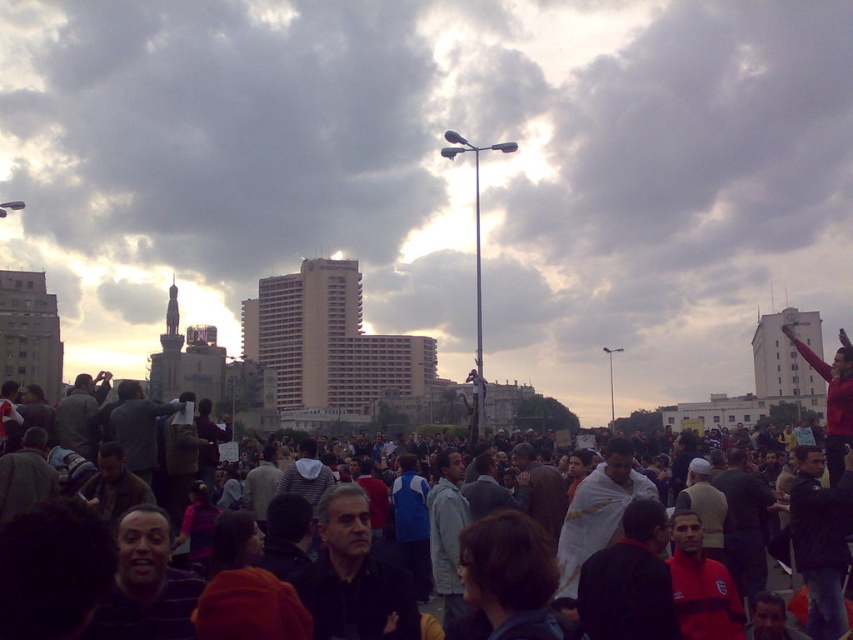
You are a photographer standing in the crowd and want to take a photo of the cloudy sky at upper center without the dark clothing crowd at center blocking the view. Is this possible?

The cloudy sky at upper center is further to the viewer than the dark clothing crowd at center, so the crowd is between the photographer and the sky. Therefore, the dark clothing crowd at center would block the view of the cloudy sky at upper center, making it impossible to take a clear photo without obstruction.

Consider the image. You are standing at the point closest to the center of the image. Which of the two points, point (801, 45) or point (370, 460), is farther away from you?

Point (801, 45) is farther away from you because it is positioned behind point (370, 460).